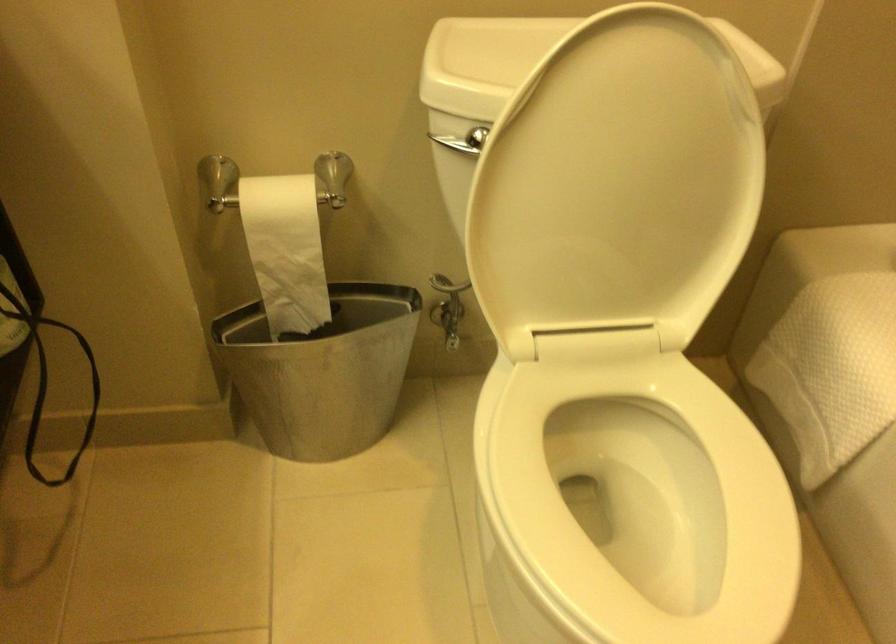
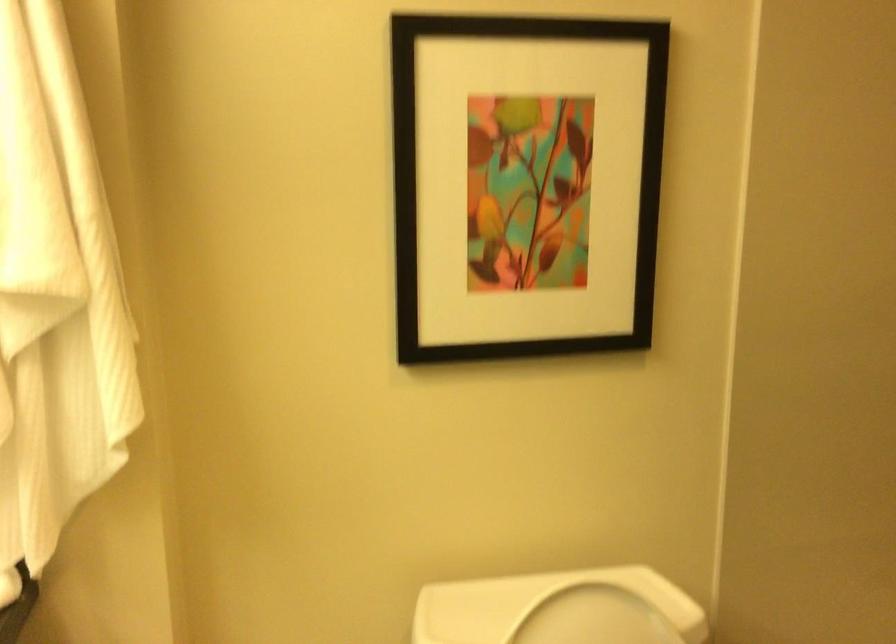
Question: Based on the continuous images, in which direction is the camera rotating? Reply with the corresponding letter.

Choices:
 (A) Left
 (B) Right
 (C) Up
 (D) Down

Answer: (C)